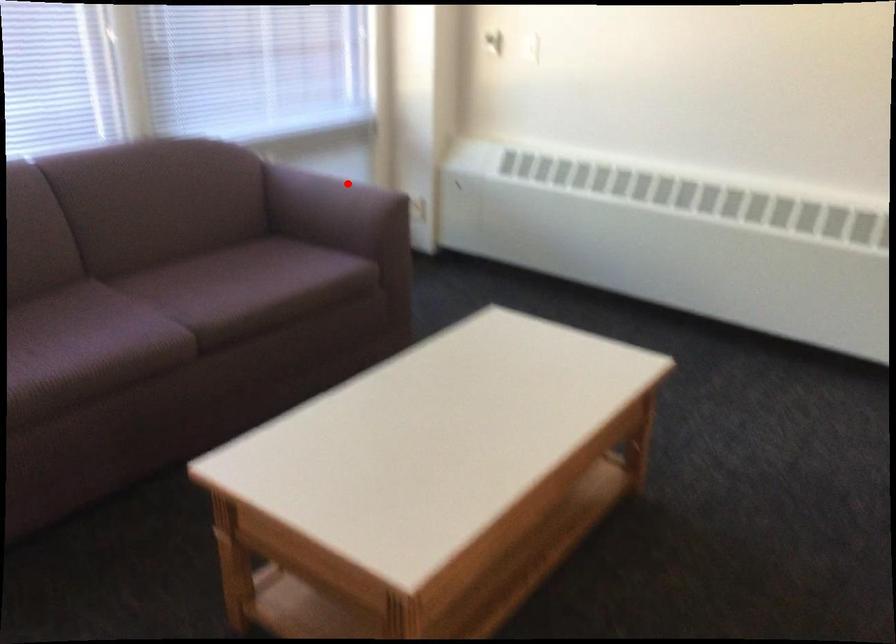
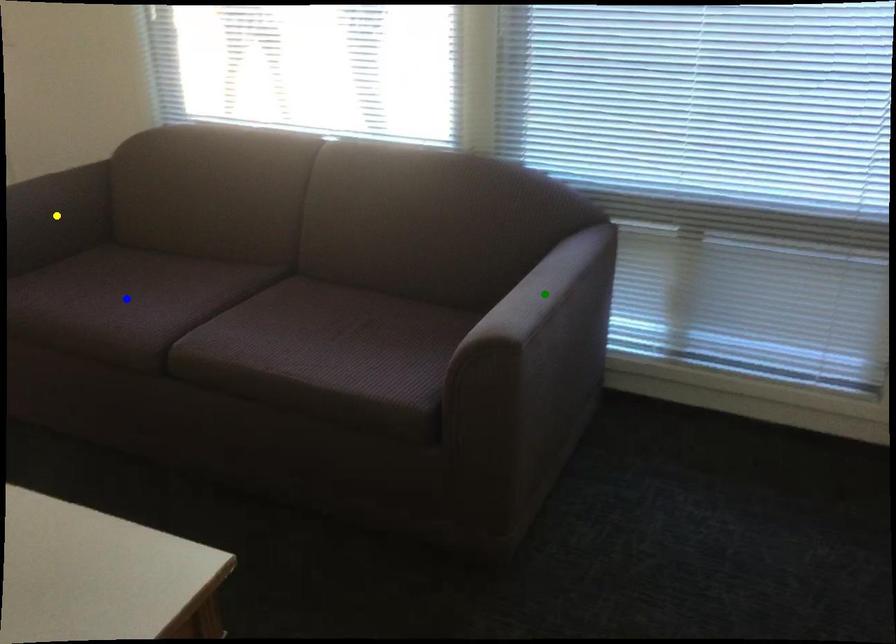
Question: I am providing you with two images of the same scene from different viewpoints. A red point is marked on the first image. You are given multiple points on the second image. In image 2, which mark is for the same physical point as the one in image 1?

Choices:
 (A) green point
 (B) blue point
 (C) yellow point

Answer: (A)